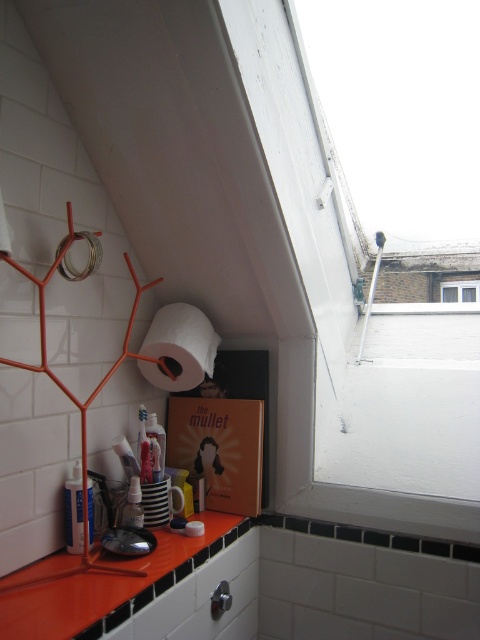
You are organizing items in the bathroom and need to place a new translucent plastic bottle at lower left. Considering the orange glossy countertop at lower center, where should you position the bottle relative to the countertop?

The orange glossy countertop at lower center is below the translucent plastic bottle at lower left, so you should place the bottle above the countertop to maintain the existing arrangement.

You are standing in the bathroom and want to place a new decorative item on the orange glossy countertop at lower center. According to the image, where exactly should you place it?

The orange glossy countertop at lower center is located at point 2D coordinates of (x=111, y=588). Place the decorative item there.

You are standing in the bathroom and want to hang a small towel. The white matte toilet paper at center is currently blocking your view of the transparent glass window at upper right. Where should you place the towel so it doesn

The white matte toilet paper at center is in front of the transparent glass window at upper right, so placing the towel behind the white matte toilet paper at center would allow it to be visible without obstructing the window view.